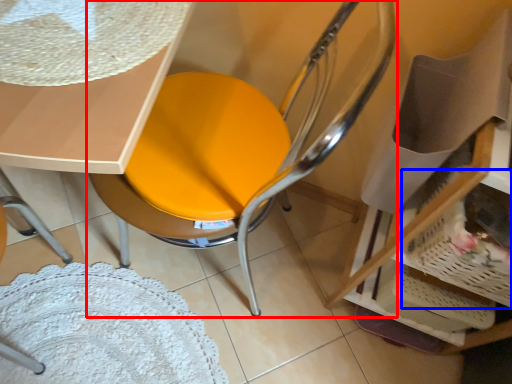
Question: Which of the following is the farthest to the observer, chair (highlighted by a red box) or basket (highlighted by a blue box)?

Choices:
 (A) chair
 (B) basket

Answer: (B)